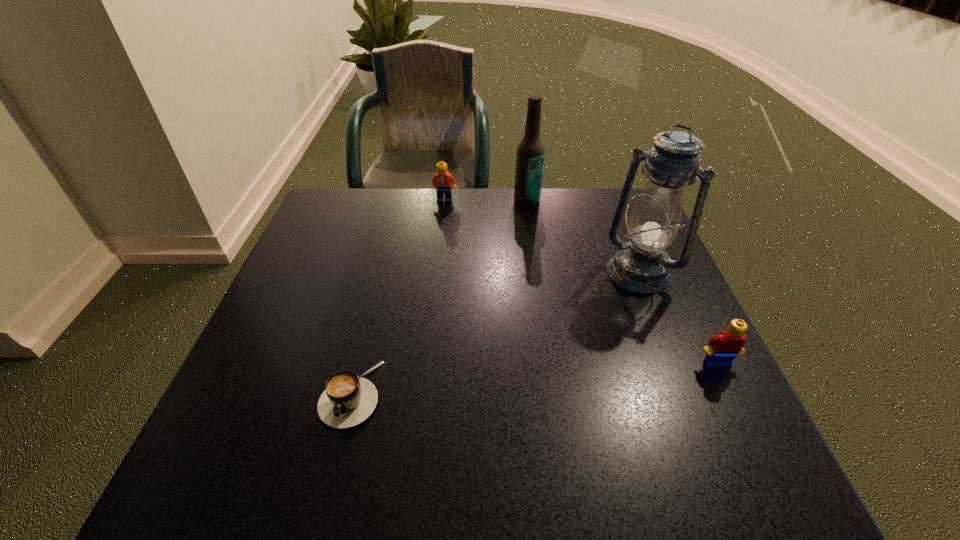
This screenshot has height=540, width=960. What are the coordinates of `free space located on the front-facing side of the farther Lego` in the screenshot? It's located at (455, 218).

What are the coordinates of `free region located 0.290m on the front-facing side of the farther Lego` in the screenshot? It's located at (477, 265).

Image resolution: width=960 pixels, height=540 pixels. In order to click on vacant space located on the front-facing side of the farther Lego in this screenshot , I will do `click(480, 273)`.

Locate an element on the screen. The width and height of the screenshot is (960, 540). free point located on the label of the second tallest object is located at coordinates (517, 291).

Identify the location of vacant space located on the label of the second tallest object. (520, 263).

You are a GUI agent. You are given a task and a screenshot of the screen. Output one action in this format:
    pyautogui.click(x=<x>, y=<y>)
    Task: Click on the vacant space located 0.340m on the label of the second tallest object
    
    Given the screenshot: What is the action you would take?
    pyautogui.click(x=517, y=291)

Locate an element on the screen. The height and width of the screenshot is (540, 960). free space located 0.360m on the front-facing side of the third nearest object is located at coordinates (540, 399).

I want to click on vacant space located 0.170m on the front-facing side of the third nearest object, so [x=590, y=335].

Identify the location of vacant space located on the front-facing side of the third nearest object. This screenshot has width=960, height=540. (560, 373).

At what (x,y) coordinates should I click in order to perform the action: click on Lego that is at the far edge. Please return your answer as a coordinate pair (x, y). Looking at the image, I should click on (443, 180).